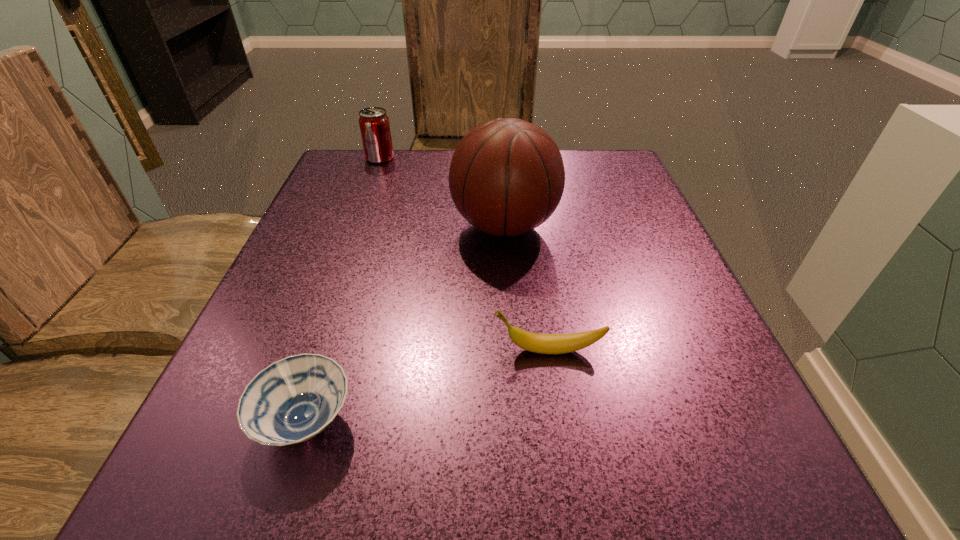
At what (x,y) coordinates should I click in order to perform the action: click on basketball. Please return your answer as a coordinate pair (x, y). Image resolution: width=960 pixels, height=540 pixels. Looking at the image, I should click on (506, 177).

Find the location of a particular element. the second farthest object is located at coordinates (506, 177).

At what (x,y) coordinates should I click in order to perform the action: click on the third shortest object. Please return your answer as a coordinate pair (x, y). Looking at the image, I should click on (374, 124).

The width and height of the screenshot is (960, 540). I want to click on pop soda, so click(x=374, y=124).

Find the location of a particular element. This screenshot has height=540, width=960. banana is located at coordinates (534, 342).

The width and height of the screenshot is (960, 540). What are the coordinates of `the third tallest object` in the screenshot? It's located at (534, 342).

The width and height of the screenshot is (960, 540). What are the coordinates of `soup bowl` in the screenshot? It's located at (292, 400).

Identify the location of the nearest object. This screenshot has width=960, height=540. pos(292,400).

Find the location of `vacant space positioned on the left of the tallest object`. vacant space positioned on the left of the tallest object is located at coordinates (406, 226).

What are the coordinates of `blank space located 0.070m on the left of the pop soda` in the screenshot? It's located at (337, 158).